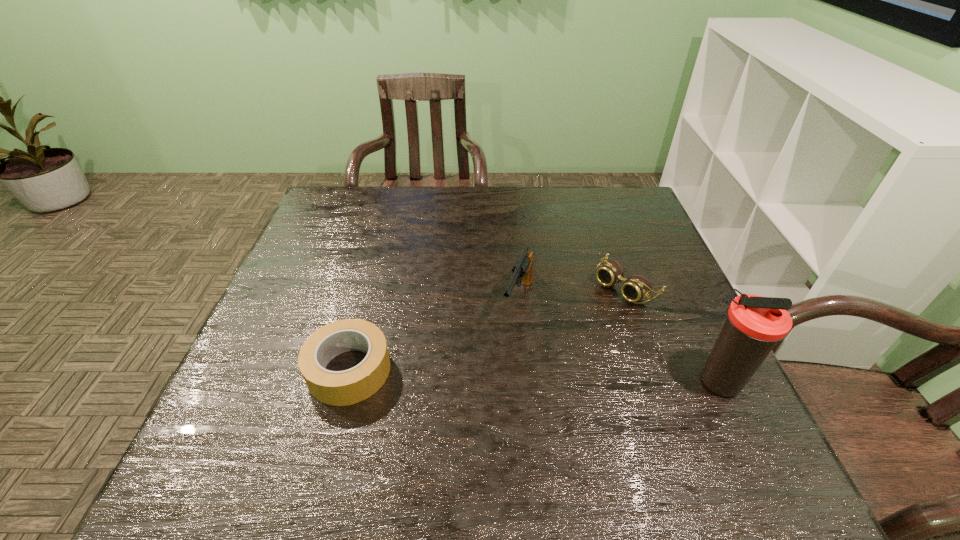
The width and height of the screenshot is (960, 540). Find the location of `object present at the near right corner`. object present at the near right corner is located at coordinates (754, 324).

Where is `vacant space at the far edge of the desktop`? The height and width of the screenshot is (540, 960). vacant space at the far edge of the desktop is located at coordinates (491, 204).

You are a GUI agent. You are given a task and a screenshot of the screen. Output one action in this format:
    pyautogui.click(x=<x>, y=<y>)
    Task: Click on the blank area at the near edge
    Image resolution: width=960 pixels, height=540 pixels.
    Given the screenshot: What is the action you would take?
    pyautogui.click(x=470, y=429)

Image resolution: width=960 pixels, height=540 pixels. What are the coordinates of `vacant space at the left edge` in the screenshot? It's located at (286, 295).

The width and height of the screenshot is (960, 540). In order to click on vacant space at the right edge of the desktop in this screenshot , I will do `click(684, 339)`.

This screenshot has width=960, height=540. In the image, there is a desktop. Find the location of `vacant space at the far left corner`. vacant space at the far left corner is located at coordinates (319, 209).

The height and width of the screenshot is (540, 960). In order to click on vacant space at the far right corner of the desktop in this screenshot , I will do `click(615, 210)`.

In order to click on free space between the goggles and the second tallest object in this screenshot , I will do `click(572, 294)`.

Find the location of a particular element. The width and height of the screenshot is (960, 540). vacant space in between the goggles and the leftmost object is located at coordinates (486, 328).

Where is `free spot between the leftmost object and the second object from left to right`? This screenshot has width=960, height=540. free spot between the leftmost object and the second object from left to right is located at coordinates (432, 335).